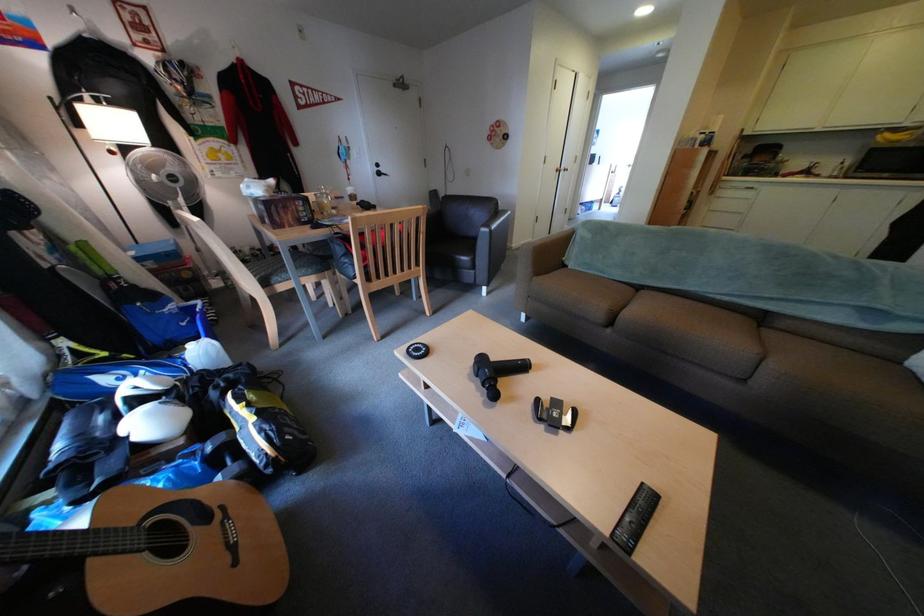
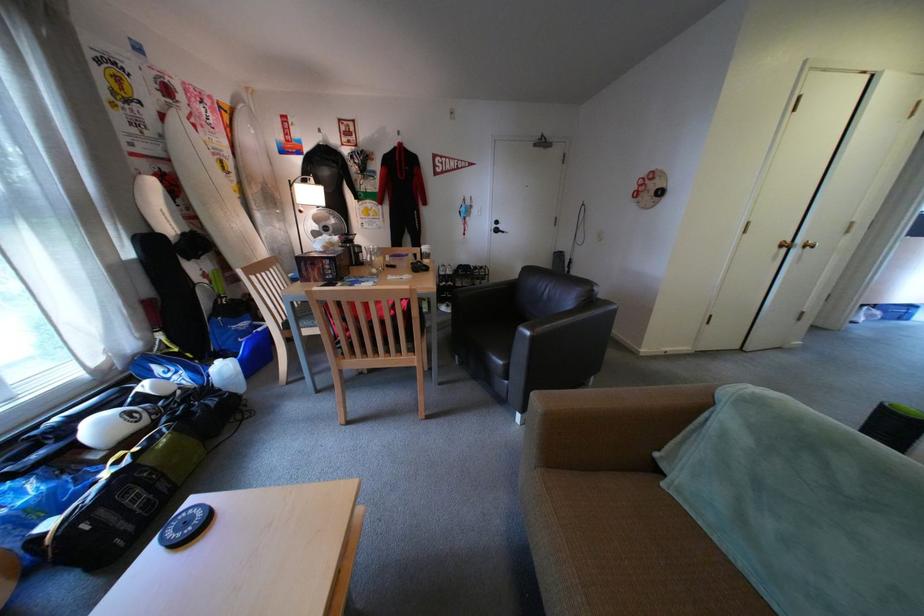
Where in the second image is the point corresponding to the point at 390,175 from the first image?

(506, 232)